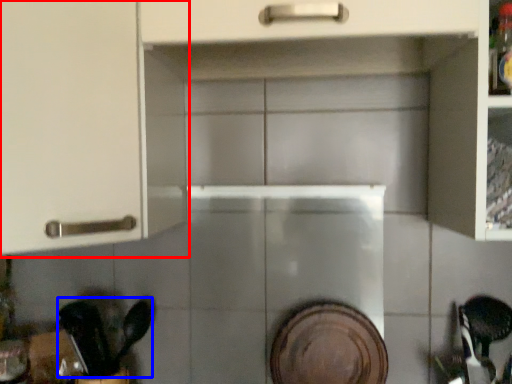
Question: Which of the following is the closest to the observer, cabinetry (highlighted by a red box) or tableware (highlighted by a blue box)?

Choices:
 (A) cabinetry
 (B) tableware

Answer: (A)